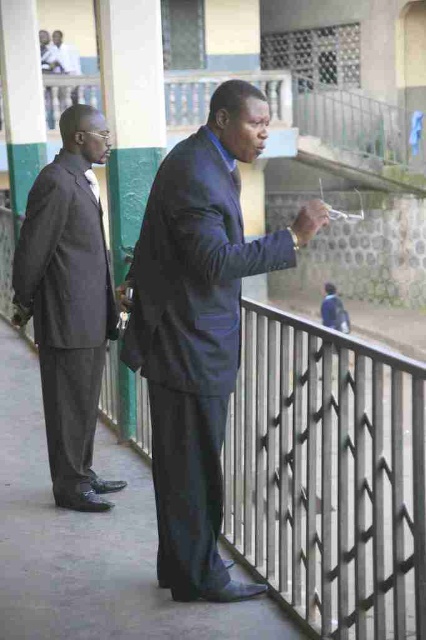
Does matte black suit at center appear on the right side of gray concrete pavement at center?

Indeed, matte black suit at center is positioned on the right side of gray concrete pavement at center.

Which of these two, matte black suit at center or gray concrete pavement at center, stands shorter?

Standing shorter between the two is gray concrete pavement at center.

Measure the distance between matte black suit at center and camera.

2.72 meters

Where is `matte black suit at center`? This screenshot has width=426, height=640. matte black suit at center is located at coordinates (198, 328).

Who is more distant from viewer, (6, 456) or (77, 332)?

The point (6, 456) is behind.

Is gray concrete pavement at center above matte gray suit at left?

No, gray concrete pavement at center is not above matte gray suit at left.

Identify the location of gray concrete pavement at center. (89, 541).

Locate an element on the screen. The width and height of the screenshot is (426, 640). gray concrete pavement at center is located at coordinates (89, 541).

Can you confirm if matte black suit at center is thinner than matte gray suit at left?

Incorrect, matte black suit at center's width is not less than matte gray suit at left's.

This screenshot has width=426, height=640. In order to click on matte black suit at center in this screenshot , I will do `click(198, 328)`.